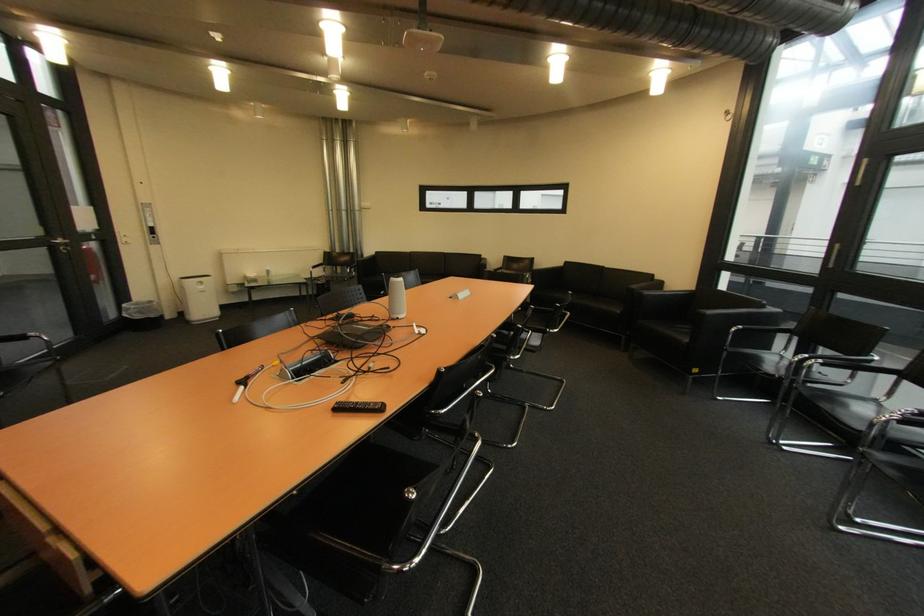
Find where to press the black remote control. Please return your answer as a coordinate pair (x, y).

(359, 407)